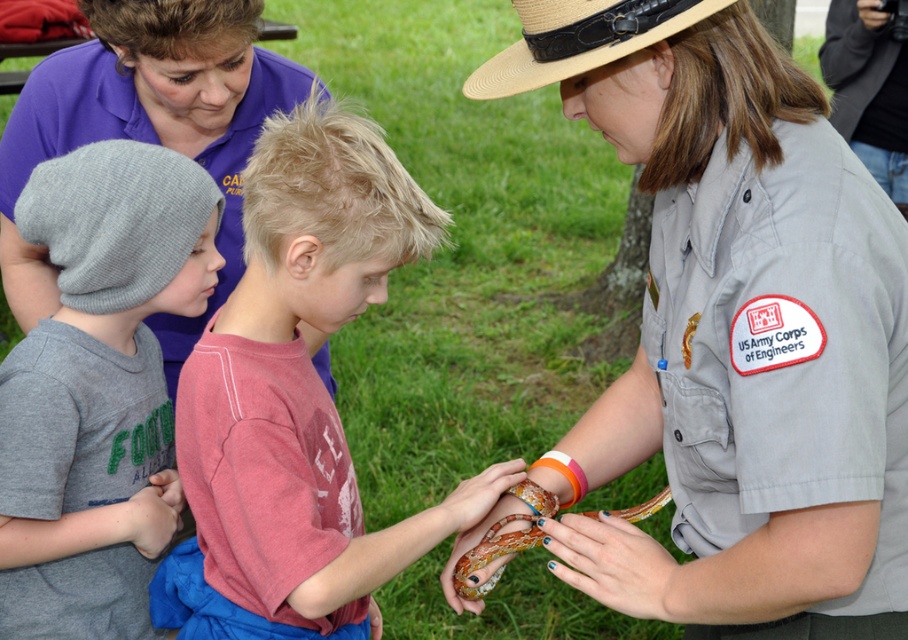
You are a photographer trying to capture a photo of the matte red shirt at center and the straw hat at upper center. Based on their positions, which object should you focus on first to ensure both are in frame?

The matte red shirt at center is located below the straw hat at upper center, so you should focus on the straw hat at upper center first to ensure both are in frame.